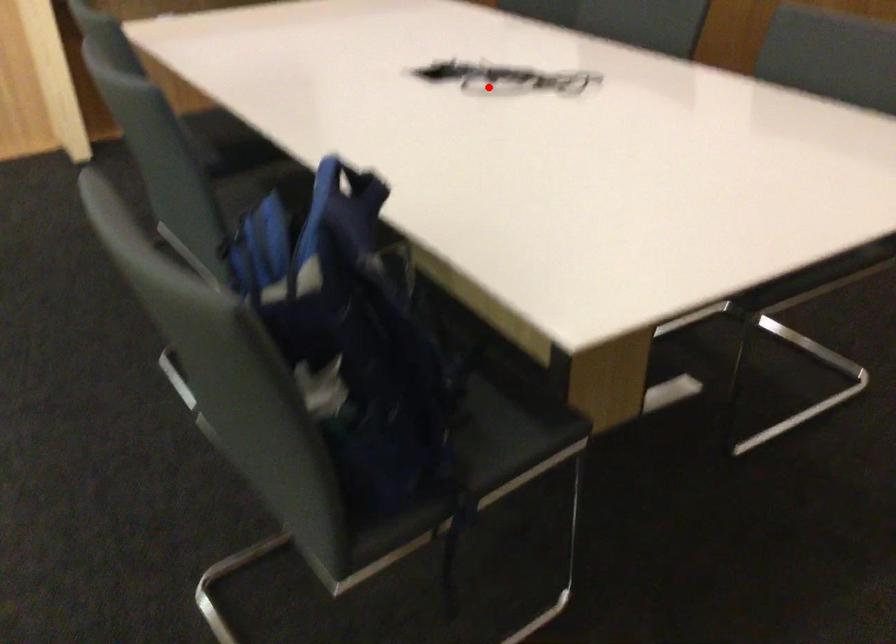
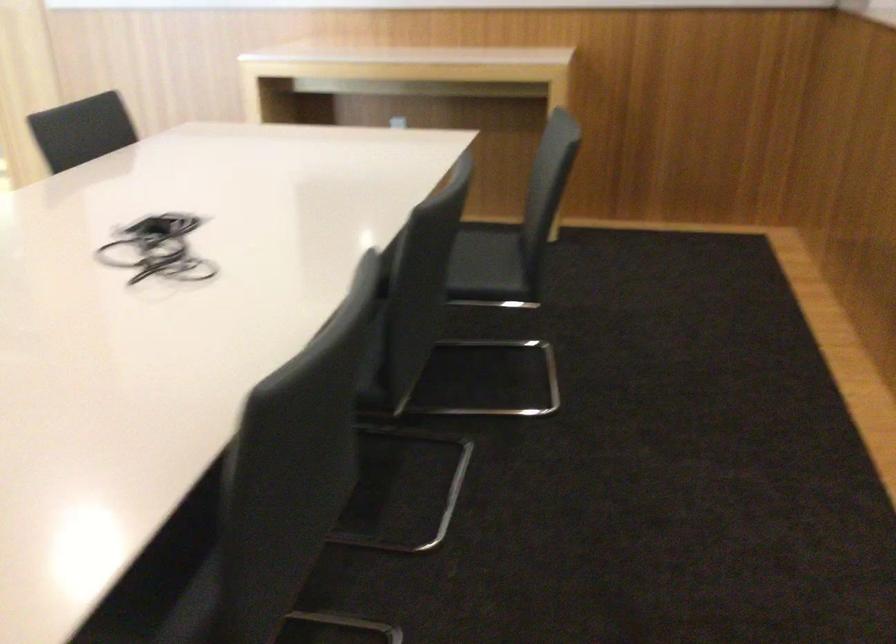
Question: I am providing you with two images of the same scene from different viewpoints. Image1 has a red point marked. In image2, the corresponding 3D location appears at what relative position? Reply with the corresponding letter.

Choices:
 (A) Closer
 (B) Farther

Answer: (A)